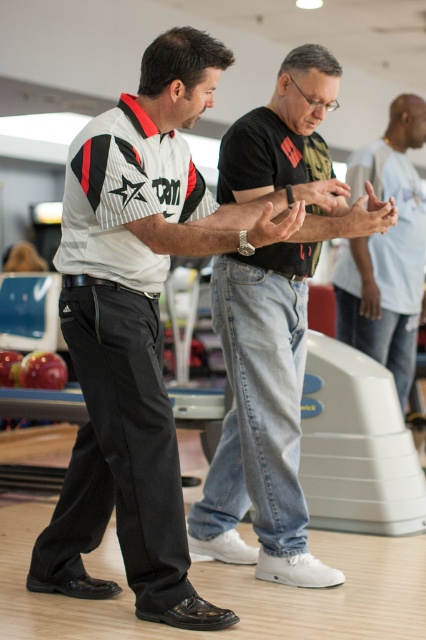
Question: Which object is positioned closest to the jeans at center?

Choices:
 (A) white matte shirt at center
 (B) denim jeans at center

Answer: (A)

Question: Can you confirm if white matte shirt at center is positioned to the left of denim jeans at center?

Choices:
 (A) yes
 (B) no

Answer: (A)

Question: Is white matte shirt at center thinner than denim jeans at center?

Choices:
 (A) no
 (B) yes

Answer: (A)

Question: Which object is the closest to the white matte shirt at center?

Choices:
 (A) jeans at center
 (B) denim jeans at center

Answer: (A)

Question: Which of the following is the closest to the observer?

Choices:
 (A) denim jeans at center
 (B) white matte shirt at center

Answer: (B)

Question: Does white matte shirt at center appear over denim jeans at center?

Choices:
 (A) no
 (B) yes

Answer: (A)